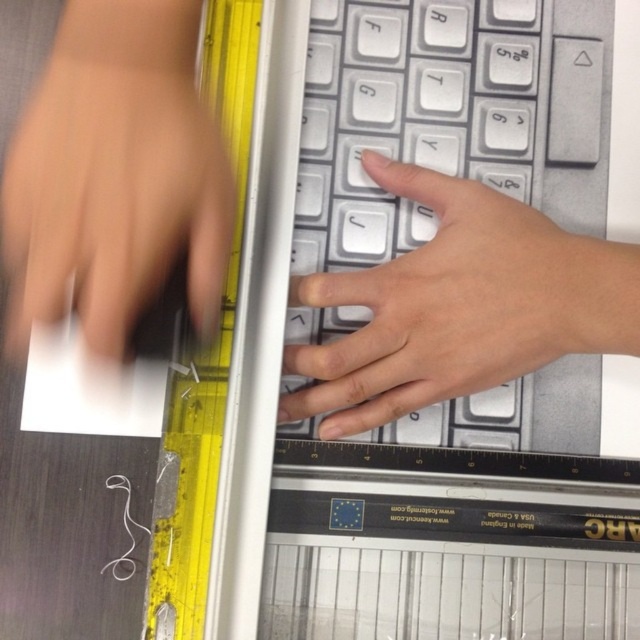
Question: Which of the following is the farthest from the observer?

Choices:
 (A) yellow plastic ruler at left
 (B) white matte hand at center
 (C) matte black hand at left

Answer: (B)

Question: Is matte black hand at left to the right of yellow plastic ruler at left from the viewer's perspective?

Choices:
 (A) yes
 (B) no

Answer: (B)

Question: Does matte black hand at left have a greater width compared to yellow plastic ruler at left?

Choices:
 (A) yes
 (B) no

Answer: (A)

Question: Which point is closer to the camera taking this photo?

Choices:
 (A) (209, 269)
 (B) (209, 474)

Answer: (A)

Question: Can you confirm if white matte hand at center is smaller than yellow plastic ruler at left?

Choices:
 (A) no
 (B) yes

Answer: (B)

Question: Considering the real-world distances, which object is farthest from the matte black hand at left?

Choices:
 (A) yellow plastic ruler at left
 (B) white matte hand at center

Answer: (B)